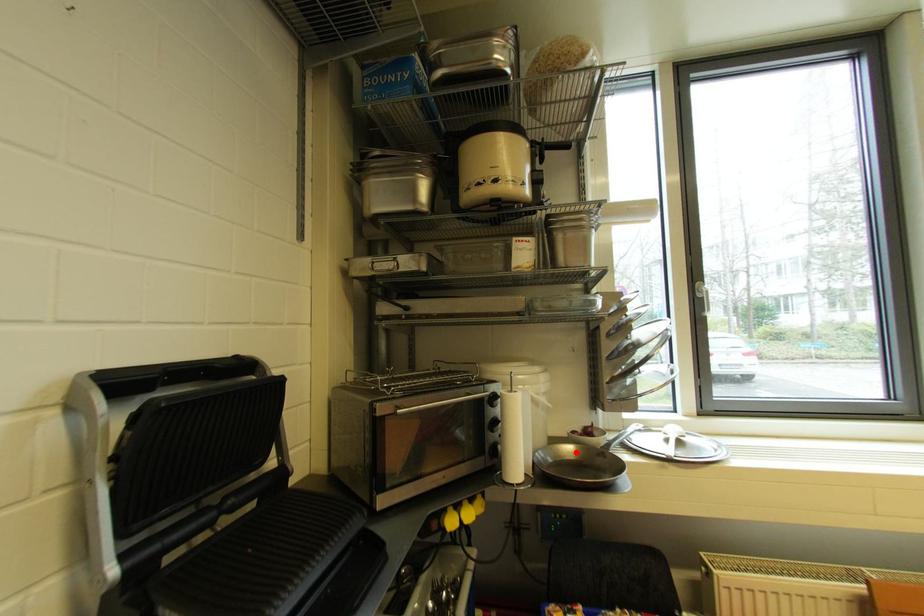
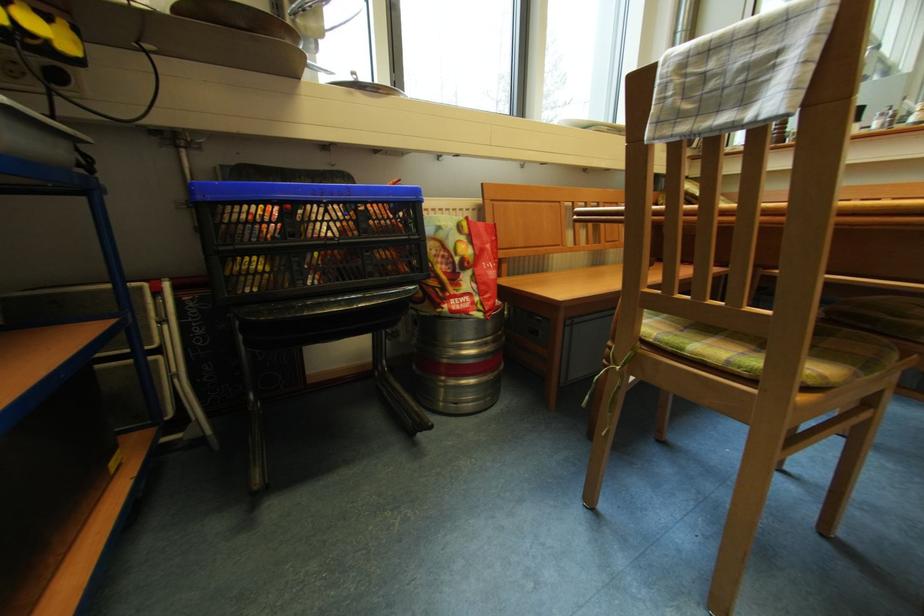
Question: I am providing you with two images of the same scene from different viewpoints. A red point is marked on the first image. Is the red point's position out of view in image 2?

Choices:
 (A) Yes
 (B) No

Answer: (A)